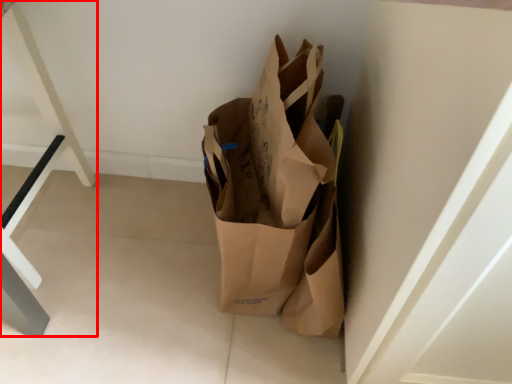
Question: Where is furniture (annotated by the red box) located in relation to grocery bag in the image?

Choices:
 (A) right
 (B) left

Answer: (B)